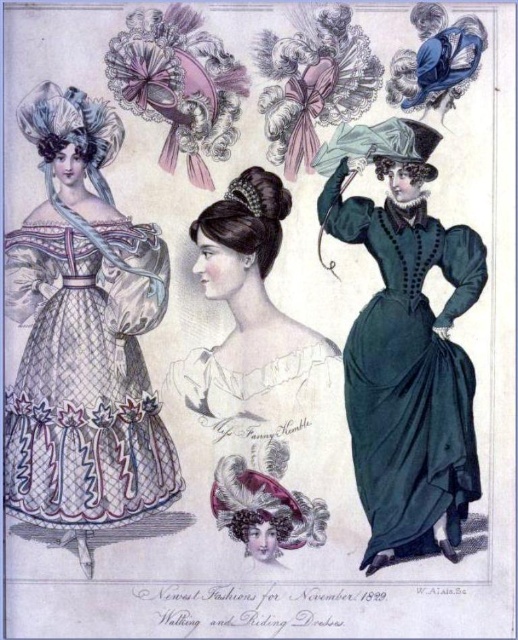
What is located at the coordinates point (x=85, y=376) in the image?

The white netted dress at left is located at point (x=85, y=376).

You are a tailor trying to decide which dress to alter first. The velvet green dress at center needs a hem adjustment, and the white lace dress at center requires a waistline alteration. Based on their sizes, which dress will require more fabric to complete its alteration?

The velvet green dress at center is larger in size than the white lace dress at center, so it will require more fabric to complete its alteration.